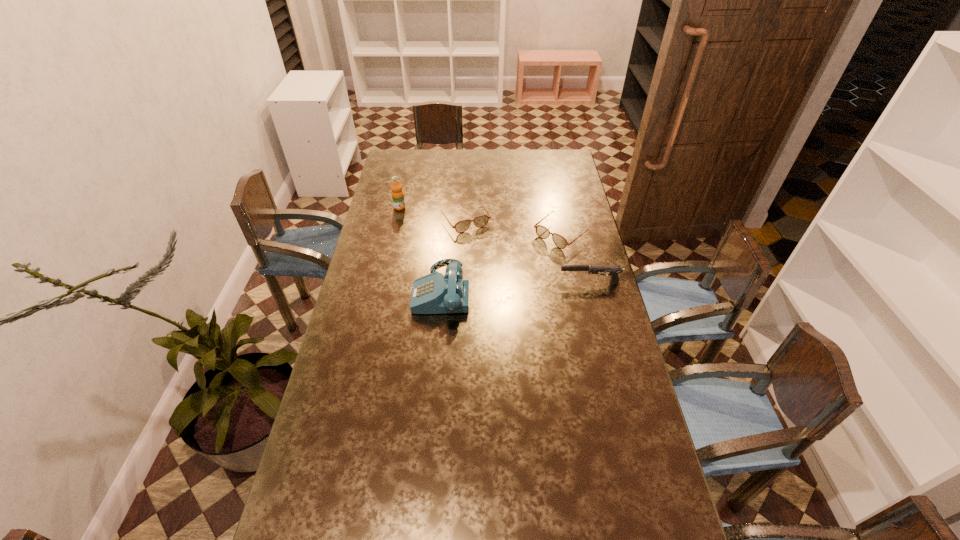
I want to click on vacant area in the image that satisfies the following two spatial constraints: 1. on the front side of the gun; 2. at the muzzle end of the right sunglasses, so click(572, 282).